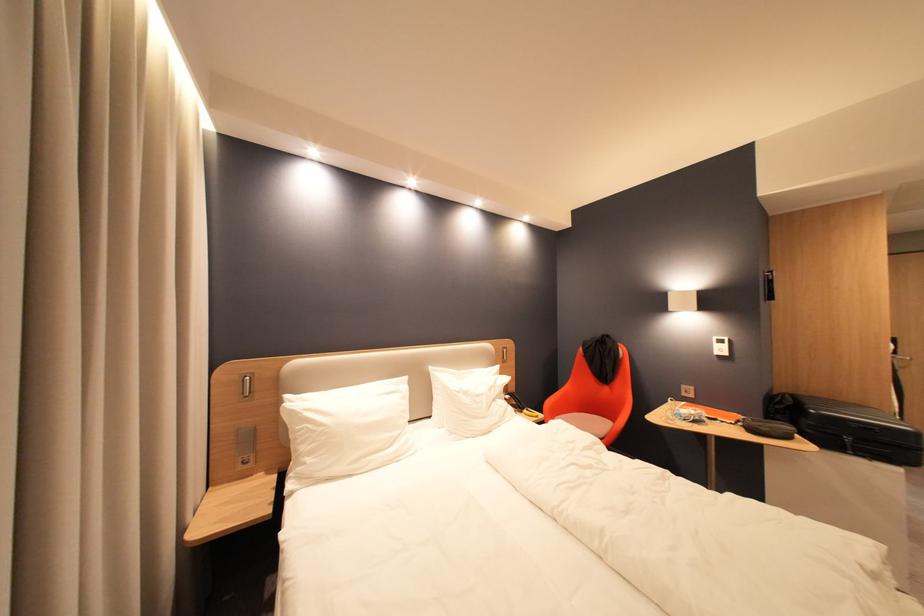
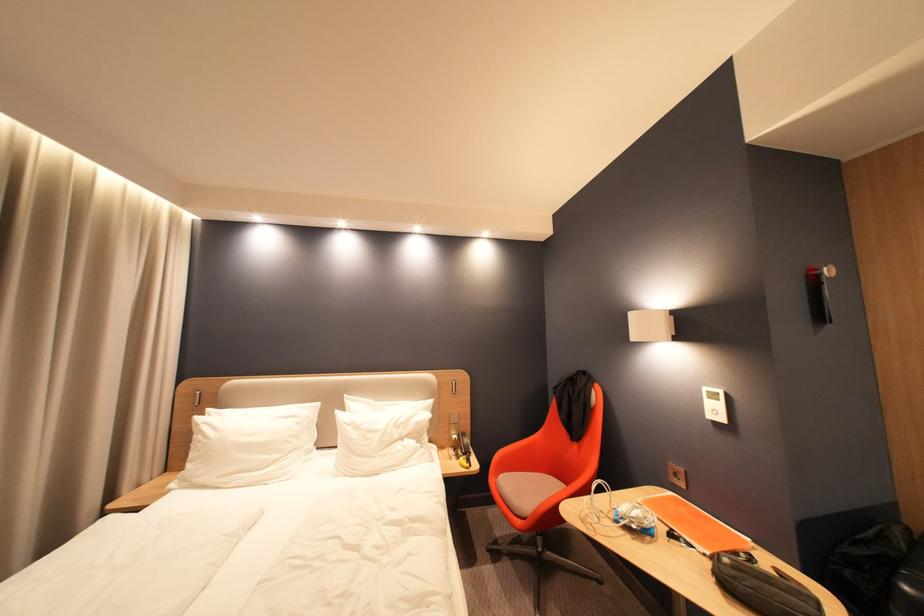
In the second image, find the point that corresponds to point 740,424 in the first image.

(714, 556)